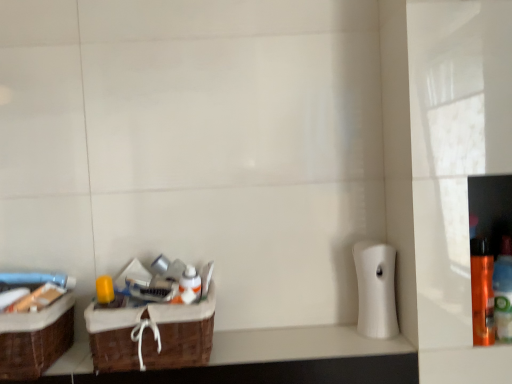
Question: Can you confirm if orange matte bottle at right, which is counted as the first bottle, starting from the right, is shorter than orange glossy spray can at right, which is counted as the 1th bottle, starting from the left?

Choices:
 (A) no
 (B) yes

Answer: (B)

Question: Is orange matte bottle at right, marked as the 2th bottle in a left-to-right arrangement, touching orange glossy spray can at right, which is counted as the 1th bottle, starting from the left?

Choices:
 (A) no
 (B) yes

Answer: (B)

Question: Is orange matte bottle at right, which is counted as the first bottle, starting from the right, oriented away from orange glossy spray can at right, which is counted as the 1th bottle, starting from the left?

Choices:
 (A) yes
 (B) no

Answer: (B)

Question: Is orange glossy spray can at right, which is counted as the 1th bottle, starting from the left, surrounded by orange matte bottle at right, marked as the 2th bottle in a left-to-right arrangement?

Choices:
 (A) yes
 (B) no

Answer: (B)

Question: From the image's perspective, is orange matte bottle at right, marked as the 2th bottle in a left-to-right arrangement, located beneath orange glossy spray can at right, which is counted as the 1th bottle, starting from the left?

Choices:
 (A) yes
 (B) no

Answer: (B)

Question: From a real-world perspective, is orange matte bottle at right, marked as the 2th bottle in a left-to-right arrangement, beneath orange glossy spray can at right, which is counted as the 1th bottle, starting from the left?

Choices:
 (A) no
 (B) yes

Answer: (B)

Question: Does orange matte bottle at right, which is counted as the first bottle, starting from the right, appear on the right side of white glossy bottle at center?

Choices:
 (A) yes
 (B) no

Answer: (A)

Question: Is orange matte bottle at right, marked as the 2th bottle in a left-to-right arrangement, turned away from white glossy bottle at center?

Choices:
 (A) yes
 (B) no

Answer: (B)

Question: Does orange matte bottle at right, marked as the 2th bottle in a left-to-right arrangement, come behind white glossy bottle at center?

Choices:
 (A) yes
 (B) no

Answer: (B)

Question: From a real-world perspective, is orange matte bottle at right, which is counted as the first bottle, starting from the right, positioned under white glossy bottle at center based on gravity?

Choices:
 (A) no
 (B) yes

Answer: (B)

Question: Is orange matte bottle at right, marked as the 2th bottle in a left-to-right arrangement, thinner than white glossy bottle at center?

Choices:
 (A) yes
 (B) no

Answer: (B)

Question: Can you confirm if orange matte bottle at right, marked as the 2th bottle in a left-to-right arrangement, is taller than white glossy bottle at center?

Choices:
 (A) no
 (B) yes

Answer: (B)

Question: Is orange glossy spray can at right, which is counted as the 1th bottle, starting from the left, inside white matte toilet paper at right?

Choices:
 (A) no
 (B) yes

Answer: (A)